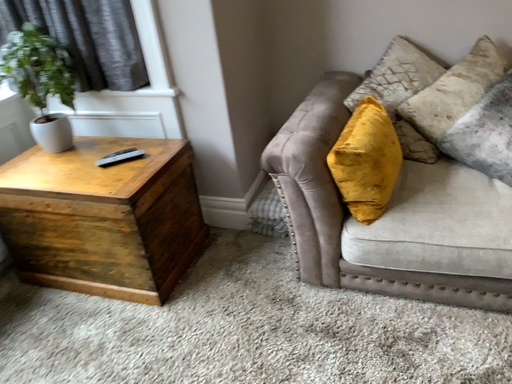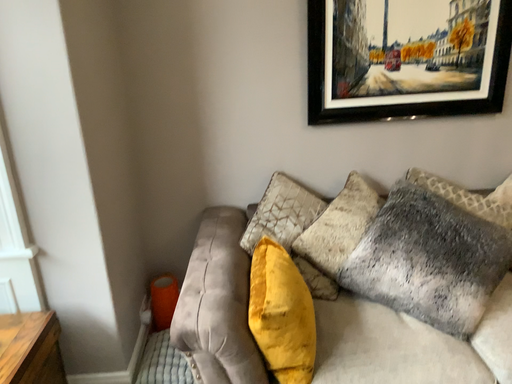
Question: How did the camera likely rotate when shooting the video?

Choices:
 (A) rotated upward
 (B) rotated downward

Answer: (A)